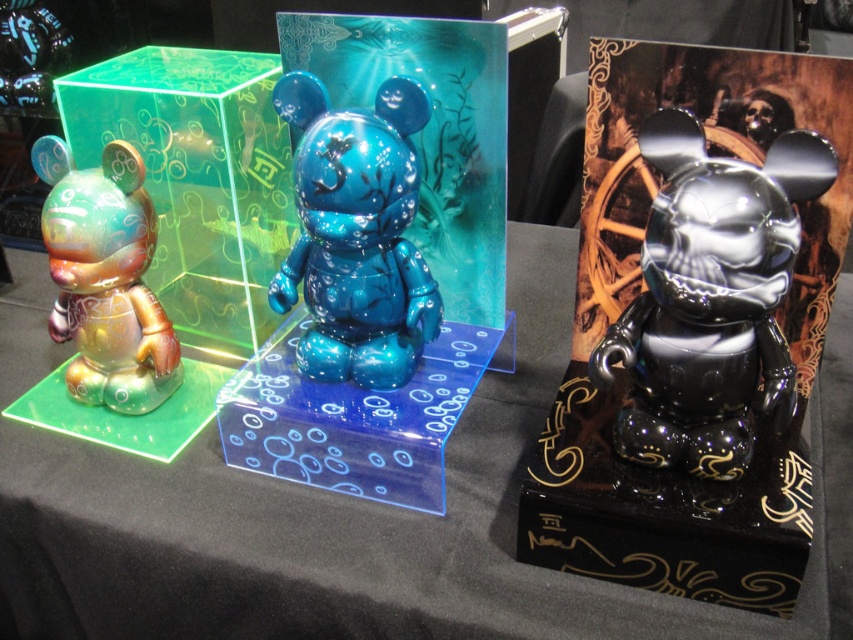
Question: Considering the real-world distances, which object is farthest from the iridescent glossy bear at left?

Choices:
 (A) translucent green cube at left
 (B) translucent blue acrylic at center
 (C) shiny black bear at right
 (D) black glossy bear at center

Answer: (C)

Question: Which point is closer to the camera taking this photo?

Choices:
 (A) pos(56,337)
 (B) pos(300,83)

Answer: (B)

Question: Considering the real-world distances, which object is closest to the translucent green cube at left?

Choices:
 (A) translucent blue acrylic at center
 (B) glossy blue bear at center

Answer: (B)

Question: Is black glossy bear at center thinner than glossy blue bear at center?

Choices:
 (A) yes
 (B) no

Answer: (B)

Question: Observing the image, what is the correct spatial positioning of shiny black bear at right in reference to translucent green cube at left?

Choices:
 (A) right
 (B) left

Answer: (A)

Question: In this image, where is translucent acrylic table at center located relative to glossy blue bear at center?

Choices:
 (A) right
 (B) left

Answer: (A)